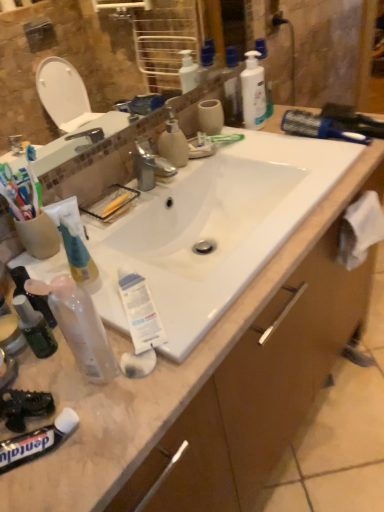
I want to click on vacant space to the right of transparent plastic spray bottle at lower left, which is the first toiletry in left-to-right order, so click(199, 351).